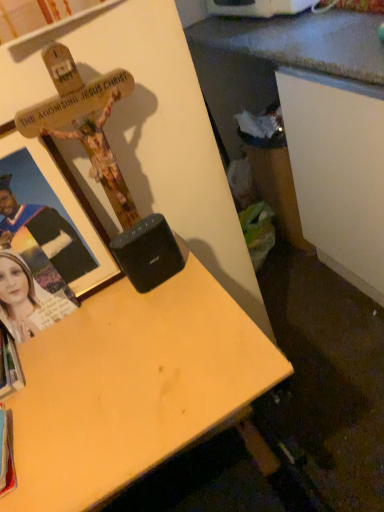
Find the location of a particular element. This screenshot has width=384, height=512. free space to the left of black plastic speaker at center is located at coordinates (95, 320).